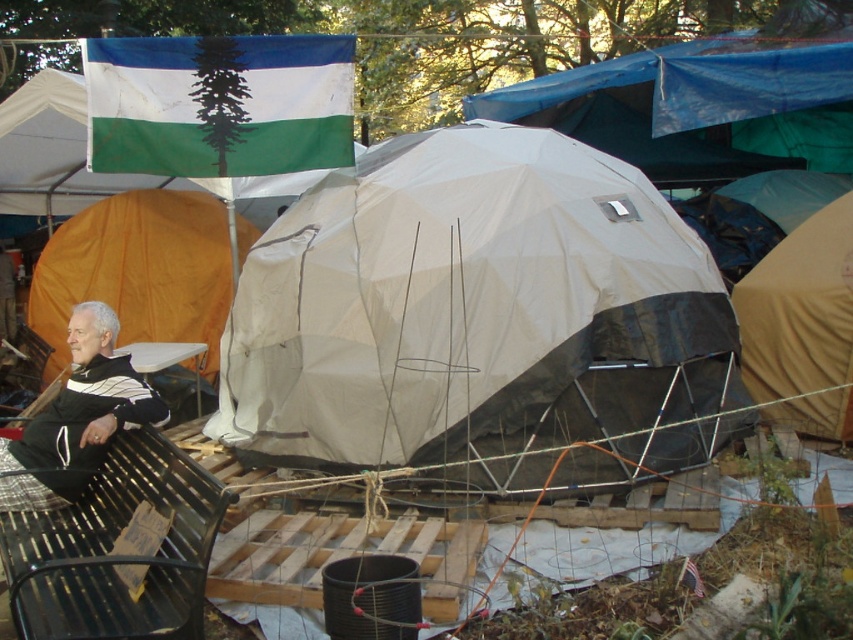
Question: Where is beige fabric tent at right located in relation to dark gray sweater at left in the image?

Choices:
 (A) above
 (B) below

Answer: (A)

Question: Which point appears closest to the camera in this image?

Choices:
 (A) (192, 323)
 (B) (97, 454)
 (C) (851, 257)

Answer: (B)

Question: Which point is closer to the camera?

Choices:
 (A) matte white tent at center
 (B) beige fabric tent at right
 (C) dark gray sweater at left

Answer: (C)

Question: Which point is farther to the camera?

Choices:
 (A) (33, 506)
 (B) (165, 308)
 (C) (814, 378)

Answer: (B)

Question: Does matte white tent at center appear over dark gray sweater at left?

Choices:
 (A) yes
 (B) no

Answer: (A)

Question: From the image, what is the correct spatial relationship of black metal park bench at lower left in relation to beige fabric tent at right?

Choices:
 (A) right
 (B) left

Answer: (B)